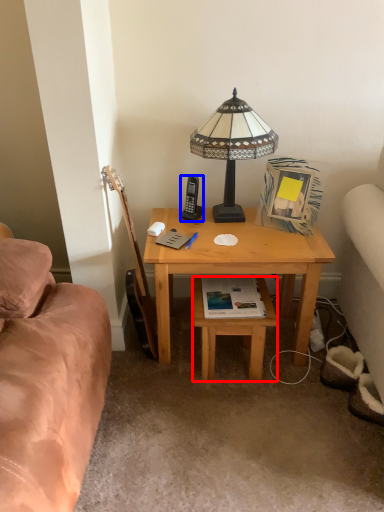
Question: Which of the following is the closest to the observer, stool (highlighted by a red box) or mobile phone (highlighted by a blue box)?

Choices:
 (A) stool
 (B) mobile phone

Answer: (A)